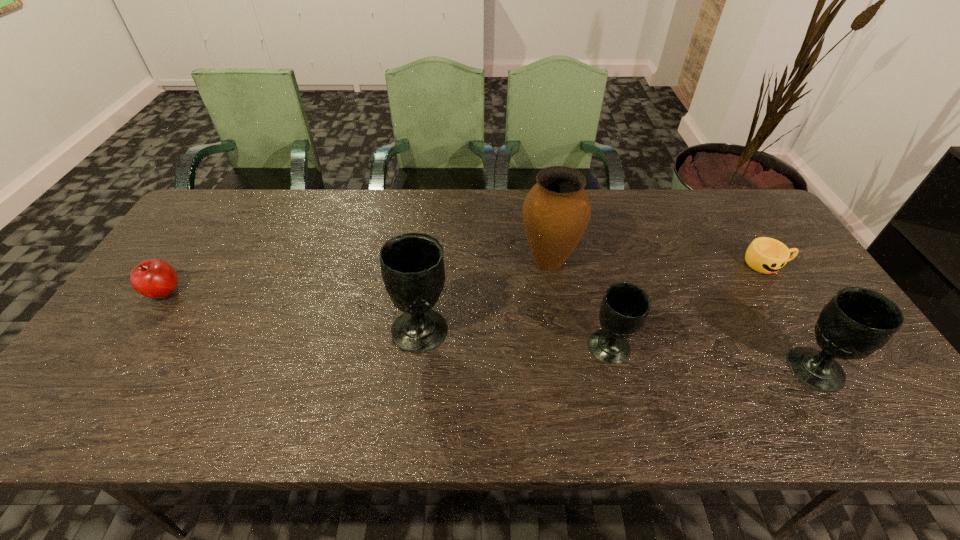
Please point a spot to add another chalice on the left. Please provide its 2D coordinates. Your answer should be formatted as a tuple, i.e. [(x, y)], where the tuple contains the x and y coordinates of a point satisfying the conditions above.

[(244, 311)]